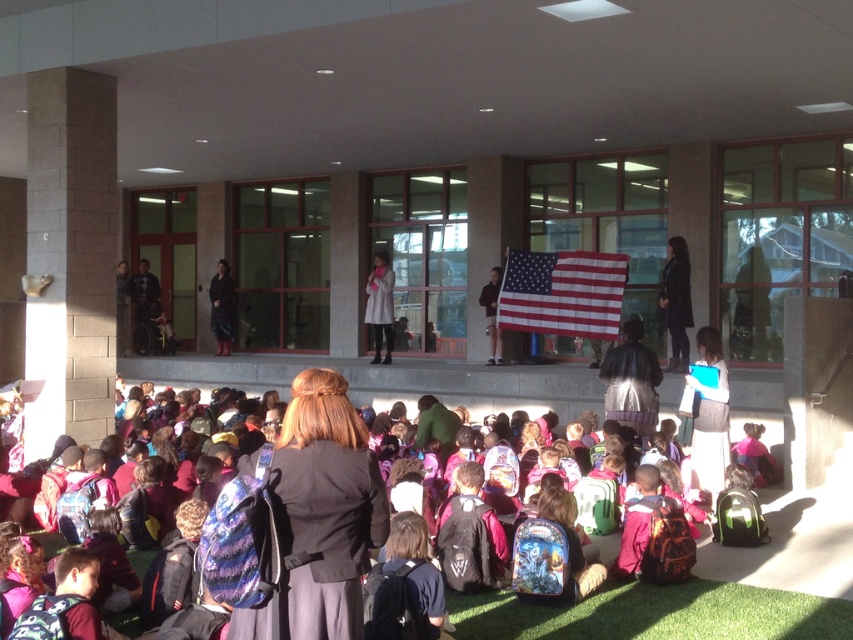
Question: Considering the real-world distances, which object is closest to the dark gray sweater at lower right?

Choices:
 (A) black leather jacket at center
 (B) red/white striped fabric flag at center
 (C) multicolored backpacks at lower center

Answer: (C)

Question: Is matte black backpack at center positioned in front of multicolored backpacks at lower center?

Choices:
 (A) no
 (B) yes

Answer: (B)

Question: Can you confirm if multicolored backpacks at lower center is smaller than red/white striped fabric flag at center?

Choices:
 (A) no
 (B) yes

Answer: (B)

Question: Which of the following is the closest to the observer?

Choices:
 (A) (683, 339)
 (B) (62, 545)

Answer: (B)

Question: Can you confirm if multicolored backpacks at lower center is bigger than black leather jacket at center?

Choices:
 (A) no
 (B) yes

Answer: (A)

Question: Which object is closer to the camera taking this photo?

Choices:
 (A) red/white striped fabric flag at center
 (B) matte black backpack at center
 (C) dark gray sweater at lower right

Answer: (B)